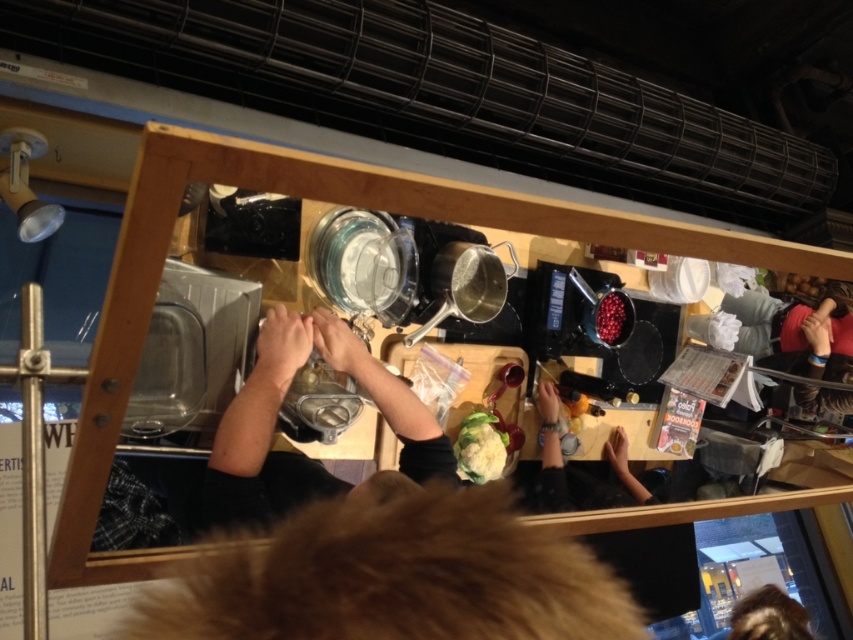
Question: Among these points, which one is nearest to the camera?

Choices:
 (A) (460, 426)
 (B) (258, 353)
 (C) (781, 616)
 (D) (318, 621)

Answer: (D)

Question: Which of the following is the closest to the observer?

Choices:
 (A) (451, 593)
 (B) (311, 476)
 (C) (461, 449)
 (D) (735, 632)

Answer: (A)

Question: Can you confirm if brown fur at center is positioned to the left of white textured cauliflower at center?

Choices:
 (A) no
 (B) yes

Answer: (B)

Question: Observing the image, what is the correct spatial positioning of metallic silver pot at center in reference to brown hair at lower right?

Choices:
 (A) left
 (B) right

Answer: (A)

Question: Can you confirm if brown hair at lower right is positioned above white textured cauliflower at center?

Choices:
 (A) yes
 (B) no

Answer: (B)

Question: Among these objects, which one is farthest from the camera?

Choices:
 (A) shiny red berries at center
 (B) metallic silver pot at center
 (C) brown hair at lower right

Answer: (A)